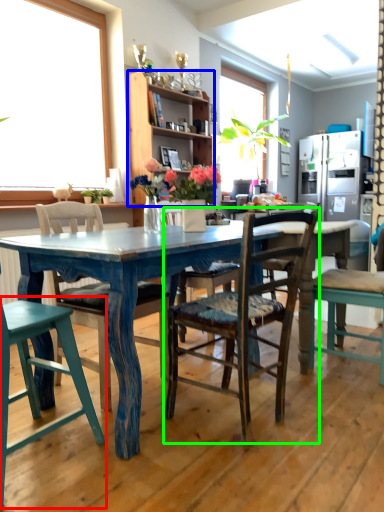
Question: Which is farther away from chair (highlighted by a red box)? cabinetry (highlighted by a blue box) or chair (highlighted by a green box)?

Choices:
 (A) cabinetry
 (B) chair

Answer: (A)